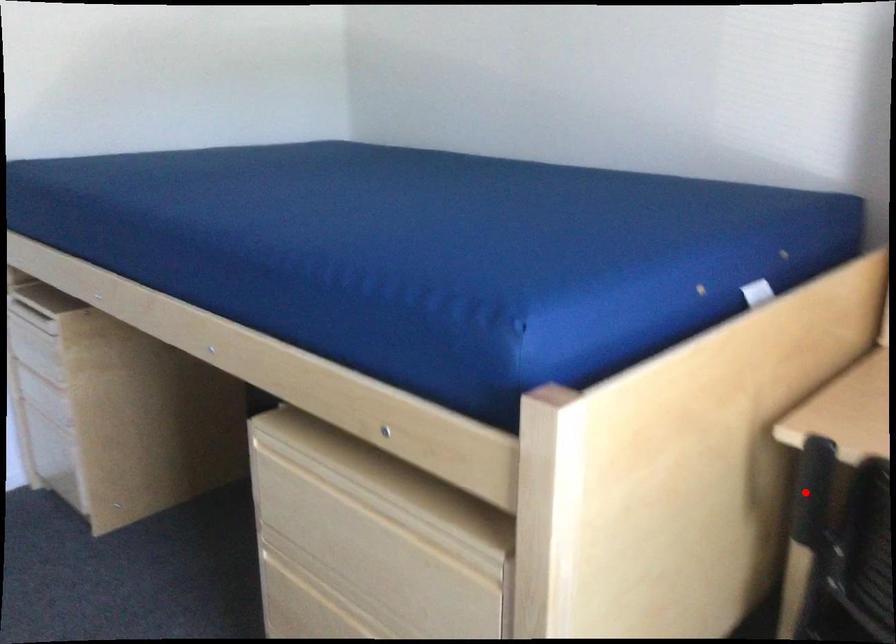
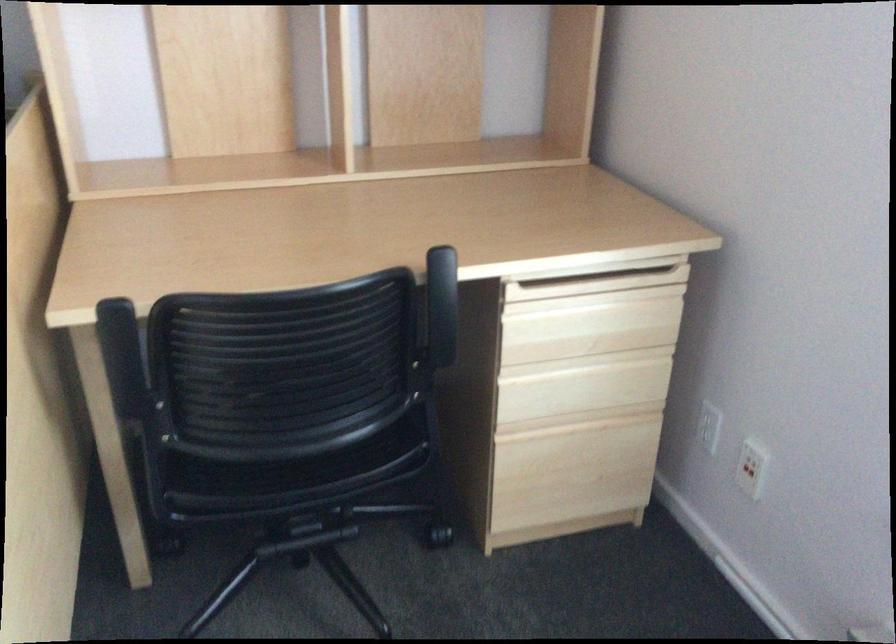
Find the pixel in the second image that matches the highlighted location in the first image.

(123, 360)